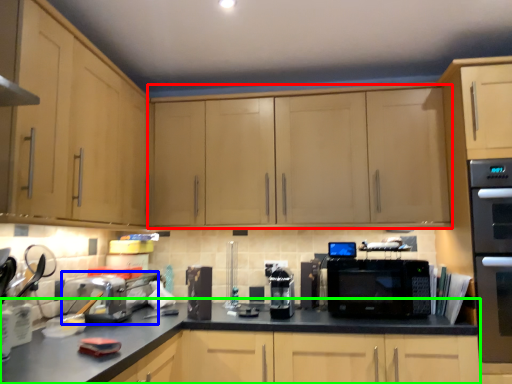
Question: Estimate the real-world distances between objects in this image. Which object is farther from cabinetry (highlighted by a red box), appliance (highlighted by a blue box) or counter top (highlighted by a green box)?

Choices:
 (A) appliance
 (B) counter top

Answer: (A)